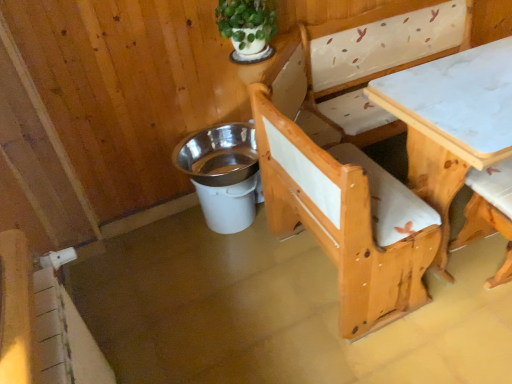
The width and height of the screenshot is (512, 384). I want to click on free space in front of white plastic bucket at lower center, so click(240, 266).